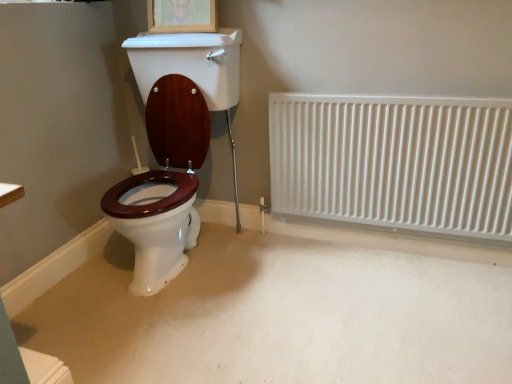
Question: Should I look upward or downward to see wooden picture frame at upper center?

Choices:
 (A) down
 (B) up

Answer: (B)

Question: From a real-world perspective, is white metallic radiator at right physically above wooden picture frame at upper center?

Choices:
 (A) yes
 (B) no

Answer: (B)

Question: Could you tell me if white metallic radiator at right is turned towards wooden picture frame at upper center?

Choices:
 (A) no
 (B) yes

Answer: (A)

Question: Is white metallic radiator at right positioned with its back to wooden picture frame at upper center?

Choices:
 (A) yes
 (B) no

Answer: (B)

Question: Is white metallic radiator at right taller than wooden picture frame at upper center?

Choices:
 (A) no
 (B) yes

Answer: (B)

Question: Is there a large distance between white metallic radiator at right and wooden picture frame at upper center?

Choices:
 (A) yes
 (B) no

Answer: (B)

Question: Considering the relative positions of white metallic radiator at right and wooden picture frame at upper center in the image provided, is white metallic radiator at right behind wooden picture frame at upper center?

Choices:
 (A) no
 (B) yes

Answer: (A)

Question: From the image's perspective, would you say wooden picture frame at upper center is shown under white metallic radiator at right?

Choices:
 (A) no
 (B) yes

Answer: (A)

Question: Could you tell me if wooden picture frame at upper center is turned towards white metallic radiator at right?

Choices:
 (A) no
 (B) yes

Answer: (A)

Question: Is wooden picture frame at upper center oriented away from white metallic radiator at right?

Choices:
 (A) no
 (B) yes

Answer: (A)

Question: Does wooden picture frame at upper center have a lesser width compared to white metallic radiator at right?

Choices:
 (A) yes
 (B) no

Answer: (B)

Question: Does wooden picture frame at upper center come behind white metallic radiator at right?

Choices:
 (A) no
 (B) yes

Answer: (B)

Question: From the image's perspective, is wooden picture frame at upper center above white metallic radiator at right?

Choices:
 (A) no
 (B) yes

Answer: (B)

Question: Based on their positions, is wooden picture frame at upper center located to the left or right of white metallic radiator at right?

Choices:
 (A) left
 (B) right

Answer: (A)